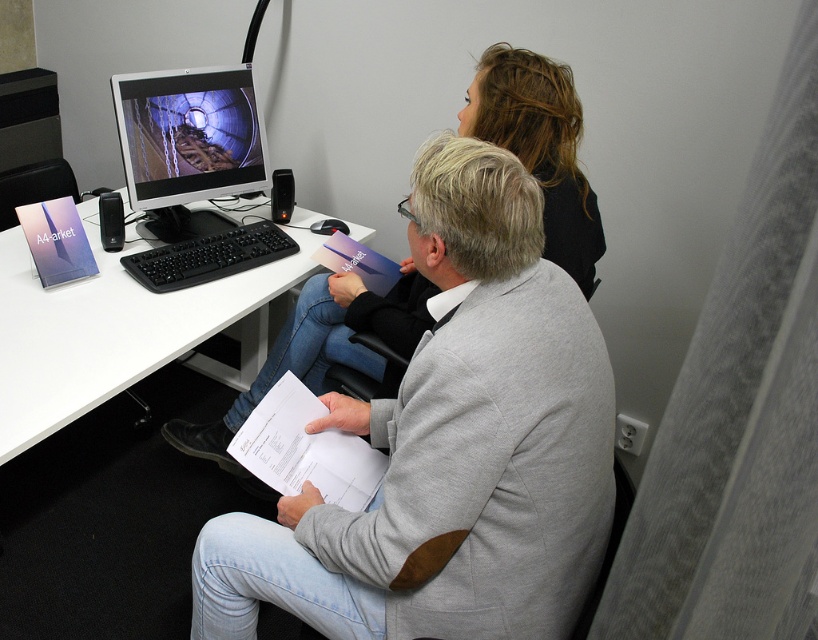
You are standing at point A located at point (571, 208). You need to walk to point B, which is 4.87 feet away from you. Can you estimate how many steps it would take if each step is about 2.5 feet?

The distance between point A located at point (571, 208) and point B is 4.87 feet. Since each step is approximately 2.5 feet, you would need about 2 steps to cover the distance.

From the picture: You are a delivery person who needs to place a 17 inch package on the desk. Can you fit it between the white plastic computer desk at lower left and the black fabric hair at upper center?

The distance between the white plastic computer desk at lower left and the black fabric hair at upper center is 17.33 inches, so the 17 inch package can fit within that space.

You are standing at the point with coordinates point (54, 394) and want to walk towards the point with coordinates point (592, 252). Which direction should you face to move directly towards it?

To move directly from point (54, 394) to point (592, 252), you should face a direction that is approximately northwest, as the target point is located to the northwest of your current position.